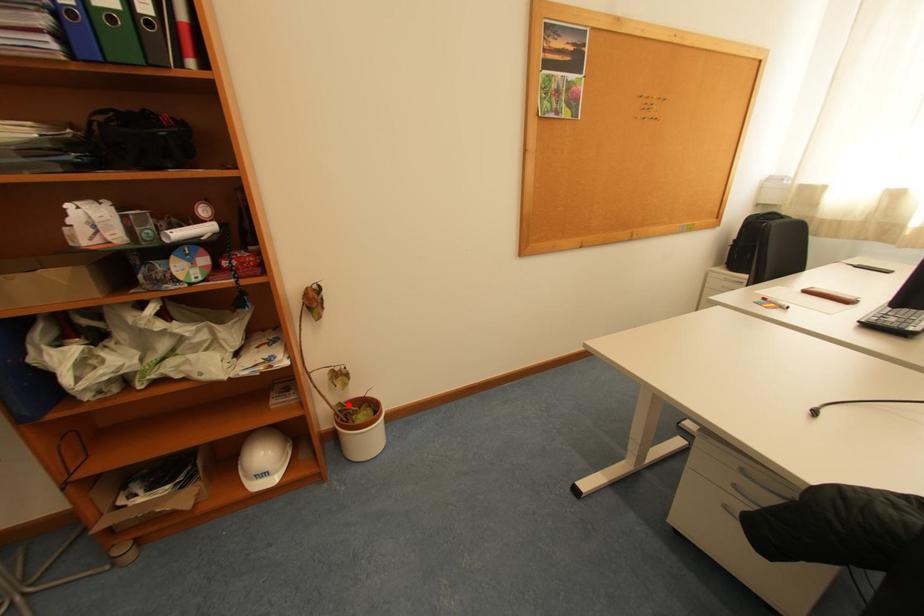
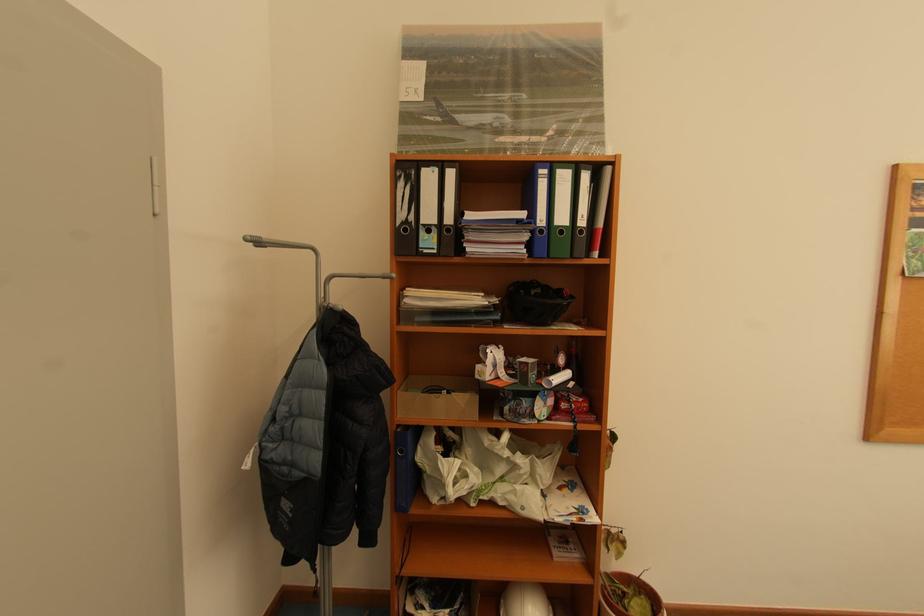
Find the pixel in the second image that matches the highlighted location in the first image.

(614, 576)